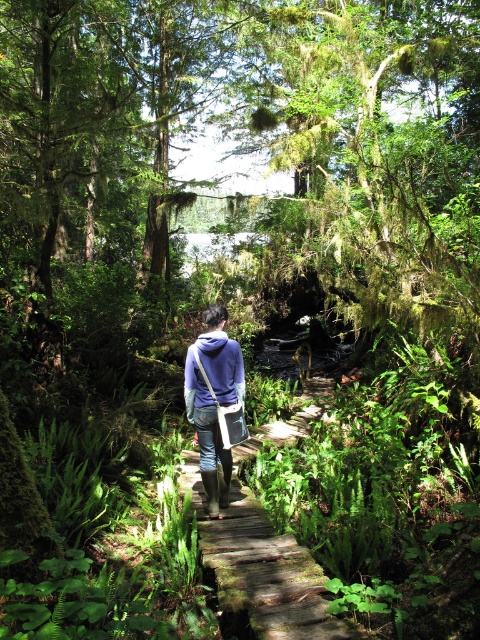
Which is behind, point (236, 540) or point (197, 349)?

The point (197, 349) is behind.

Can you confirm if wooden at center is wider than purple matte jacket at center?

In fact, wooden at center might be narrower than purple matte jacket at center.

Identify the location of wooden at center. Image resolution: width=480 pixels, height=640 pixels. (265, 547).

This screenshot has width=480, height=640. I want to click on wooden at center, so click(265, 547).